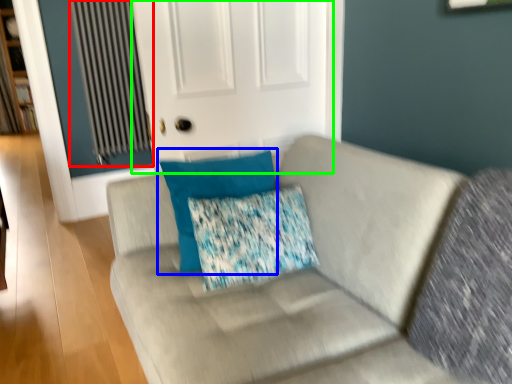
Question: Which object is the closest to the radiator (highlighted by a red box)? Choose among these: pillow (highlighted by a blue box) or screen door (highlighted by a green box).

Choices:
 (A) pillow
 (B) screen door

Answer: (B)